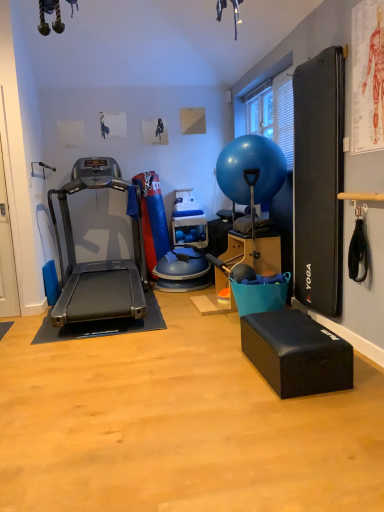
Question: Does black foam footrest at lower right have a lesser width compared to black rubber treadmill at left?

Choices:
 (A) no
 (B) yes

Answer: (B)

Question: Can you confirm if black foam footrest at lower right is positioned to the left of black rubber treadmill at left?

Choices:
 (A) yes
 (B) no

Answer: (B)

Question: Can you confirm if black foam footrest at lower right is bigger than black rubber treadmill at left?

Choices:
 (A) no
 (B) yes

Answer: (A)

Question: Does black foam footrest at lower right appear on the right side of black rubber treadmill at left?

Choices:
 (A) yes
 (B) no

Answer: (A)

Question: Does black foam footrest at lower right have a smaller size compared to black rubber treadmill at left?

Choices:
 (A) yes
 (B) no

Answer: (A)

Question: In the image, is black foam footrest at lower right on the left side or the right side of black rubber treadmill at left?

Choices:
 (A) right
 (B) left

Answer: (A)

Question: In terms of height, does black foam footrest at lower right look taller or shorter compared to black rubber treadmill at left?

Choices:
 (A) tall
 (B) short

Answer: (B)

Question: Considering the positions of point (301, 340) and point (56, 320), is point (301, 340) closer or farther from the camera than point (56, 320)?

Choices:
 (A) closer
 (B) farther

Answer: (A)

Question: Relative to black rubber treadmill at left, is black foam footrest at lower right in front or behind?

Choices:
 (A) front
 (B) behind

Answer: (A)

Question: Considering the positions of black rubber treadmill at left and blue rubber ball at center in the image, is black rubber treadmill at left wider or thinner than blue rubber ball at center?

Choices:
 (A) thin
 (B) wide

Answer: (B)

Question: Is black rubber treadmill at left spatially inside blue rubber ball at center, or outside of it?

Choices:
 (A) outside
 (B) inside

Answer: (A)

Question: From a real-world perspective, is black rubber treadmill at left physically located above or below blue rubber ball at center?

Choices:
 (A) above
 (B) below

Answer: (B)

Question: Visually, is black rubber treadmill at left positioned to the left or to the right of blue rubber ball at center?

Choices:
 (A) right
 (B) left

Answer: (B)

Question: Considering the relative positions of blue rubber ball at center and black rubber treadmill at left in the image provided, is blue rubber ball at center to the left or to the right of black rubber treadmill at left?

Choices:
 (A) right
 (B) left

Answer: (A)

Question: From the image's perspective, is blue rubber ball at center above or below black rubber treadmill at left?

Choices:
 (A) below
 (B) above

Answer: (B)